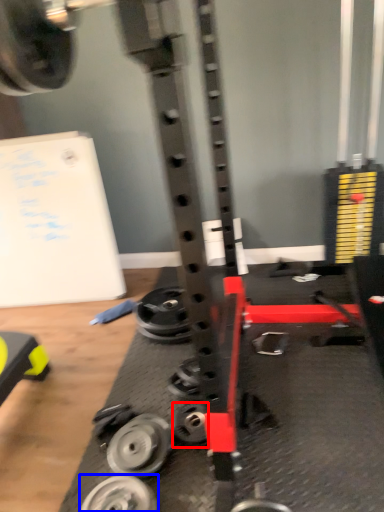
Question: Which point is closer to the camera, wheel (highlighted by a red box) or wheel (highlighted by a blue box)?

Choices:
 (A) wheel
 (B) wheel

Answer: (B)